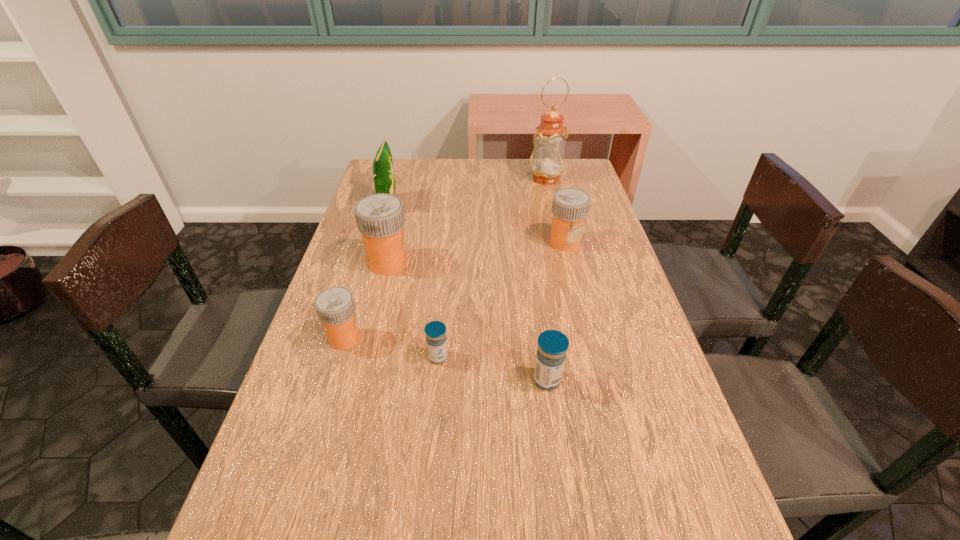
The width and height of the screenshot is (960, 540). What are the coordinates of `crisp (potato chip) that is at the left edge` in the screenshot? It's located at (384, 181).

You are a GUI agent. You are given a task and a screenshot of the screen. Output one action in this format:
    pyautogui.click(x=<x>, y=<y>)
    Task: Click on the oil lamp present at the right edge
    The width and height of the screenshot is (960, 540).
    Given the screenshot: What is the action you would take?
    pyautogui.click(x=546, y=162)

Where is `medicine located at the right edge`? medicine located at the right edge is located at coordinates (570, 206).

Image resolution: width=960 pixels, height=540 pixels. I want to click on object located in the far right corner section of the desktop, so click(546, 162).

Where is `vacant space at the far edge of the desktop`? The width and height of the screenshot is (960, 540). vacant space at the far edge of the desktop is located at coordinates (471, 169).

Where is `vacant space at the left edge`? Image resolution: width=960 pixels, height=540 pixels. vacant space at the left edge is located at coordinates (363, 385).

Where is `free spot at the right edge of the desktop`? This screenshot has width=960, height=540. free spot at the right edge of the desktop is located at coordinates (610, 272).

In the image, there is a desktop. Where is `vacant area at the far right corner`? The width and height of the screenshot is (960, 540). vacant area at the far right corner is located at coordinates (572, 185).

Where is `vacant space in between the green crisp (potato chip) and the rightmost medicine`? The width and height of the screenshot is (960, 540). vacant space in between the green crisp (potato chip) and the rightmost medicine is located at coordinates point(477,224).

In order to click on vacant space that is in between the fourth object from left to right and the farthest object in this screenshot , I will do pyautogui.click(x=492, y=268).